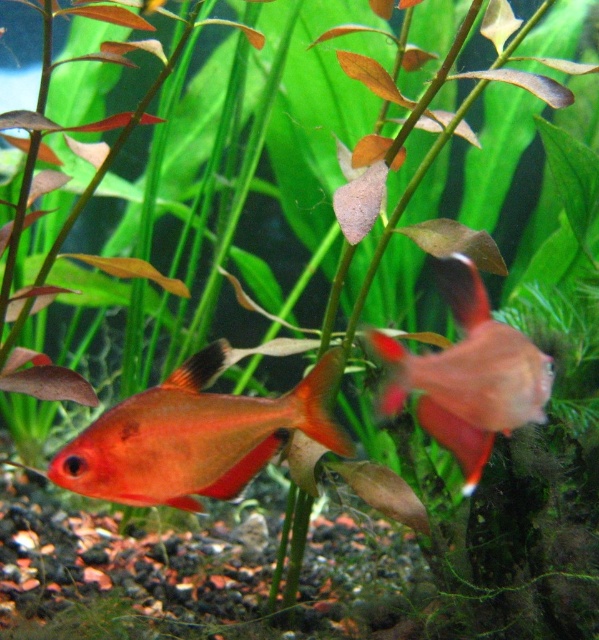
Can you confirm if shiny orange fish at center is thinner than glossy red fish at center?

No, shiny orange fish at center is not thinner than glossy red fish at center.

Who is positioned more to the left, shiny orange fish at center or glossy red fish at center?

shiny orange fish at center is more to the left.

The image size is (599, 640). What do you see at coordinates (193, 436) in the screenshot? I see `shiny orange fish at center` at bounding box center [193, 436].

Where is `shiny orange fish at center`? The image size is (599, 640). shiny orange fish at center is located at coordinates (193, 436).